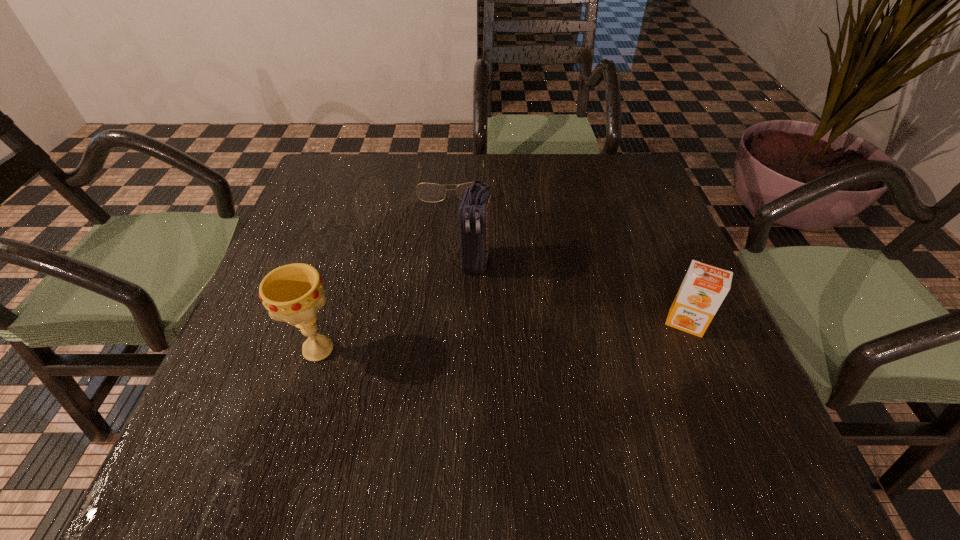
Locate an element on the screen. Image resolution: width=960 pixels, height=540 pixels. free location at the near edge is located at coordinates (593, 409).

Find the location of `blank space at the left edge of the desktop`. blank space at the left edge of the desktop is located at coordinates (268, 355).

In the image, there is a desktop. Where is `free region at the right edge`? free region at the right edge is located at coordinates (687, 358).

Where is `vacant space at the far left corner of the desktop`? The image size is (960, 540). vacant space at the far left corner of the desktop is located at coordinates (360, 184).

The image size is (960, 540). Find the location of `vacant space at the near left corner of the desktop`. vacant space at the near left corner of the desktop is located at coordinates (235, 407).

Where is `free point at the far right corner`? The height and width of the screenshot is (540, 960). free point at the far right corner is located at coordinates (594, 170).

Where is `free point between the clutch bag and the leftmost object`? Image resolution: width=960 pixels, height=540 pixels. free point between the clutch bag and the leftmost object is located at coordinates (396, 306).

What are the coordinates of `free space between the spectacles and the rightmost object` in the screenshot? It's located at (568, 253).

Find the location of a particular element. empty location between the clutch bag and the chalice is located at coordinates (396, 306).

You are a GUI agent. You are given a task and a screenshot of the screen. Output one action in this format:
    pyautogui.click(x=<x>, y=<y>)
    Task: Click on the vacant region between the orange juice and the leftmost object
    
    Given the screenshot: What is the action you would take?
    pyautogui.click(x=502, y=336)